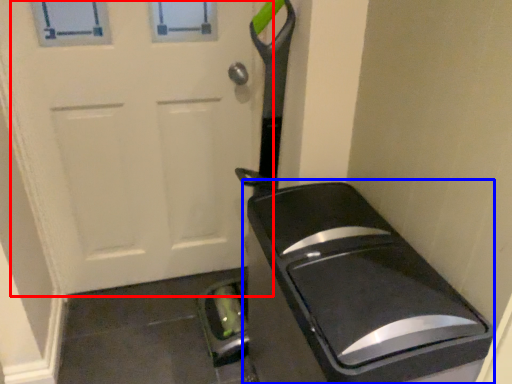
Question: Which point is closer to the camera, door (highlighted by a red box) or appliance (highlighted by a blue box)?

Choices:
 (A) door
 (B) appliance

Answer: (B)